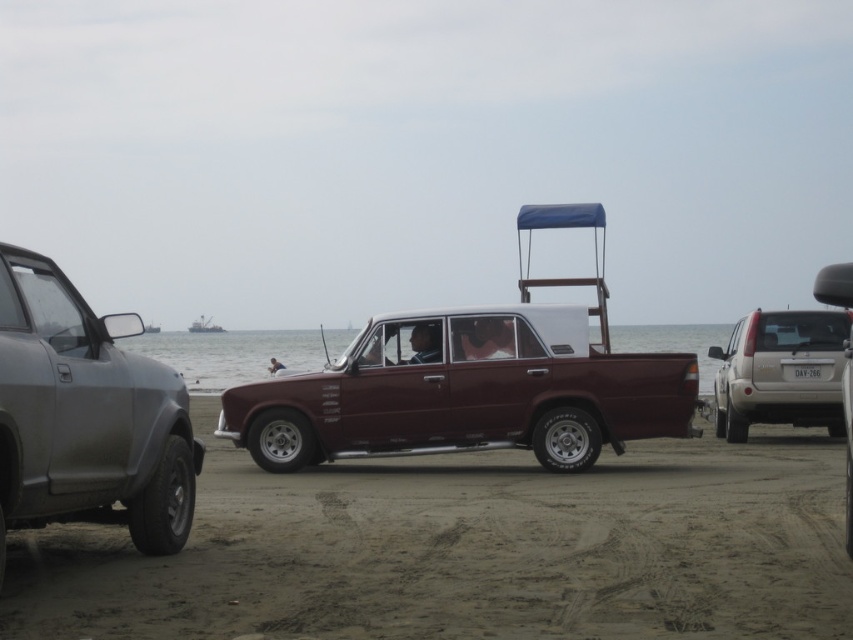
From the picture: Who is more forward, [805,323] or [155,332]?

Positioned in front is point [805,323].

Is point (796, 403) in front of point (143, 326)?

No, (796, 403) is behind (143, 326).

The width and height of the screenshot is (853, 640). What do you see at coordinates (780, 371) in the screenshot?
I see `silver metallic suv at right` at bounding box center [780, 371].

The height and width of the screenshot is (640, 853). Find the location of `silver metallic suv at right`. silver metallic suv at right is located at coordinates pyautogui.click(x=780, y=371).

Which of these two, sandy brown beach at center or metallic gray boat at center, stands shorter?

With less height is sandy brown beach at center.

Who is more distant from viewer, (675, 596) or (190, 324)?

Point (190, 324)

Which is behind, point (529, 566) or point (215, 326)?

The point (215, 326) is behind.

Find the location of a particular element. The height and width of the screenshot is (640, 853). sandy brown beach at center is located at coordinates [468, 550].

Is the position of matte gray suv at left more distant than that of metallic gray boat at left?

That is False.

This screenshot has height=640, width=853. What are the coordinates of `matte gray suv at left` in the screenshot? It's located at (86, 417).

The image size is (853, 640). I want to click on matte gray suv at left, so click(x=86, y=417).